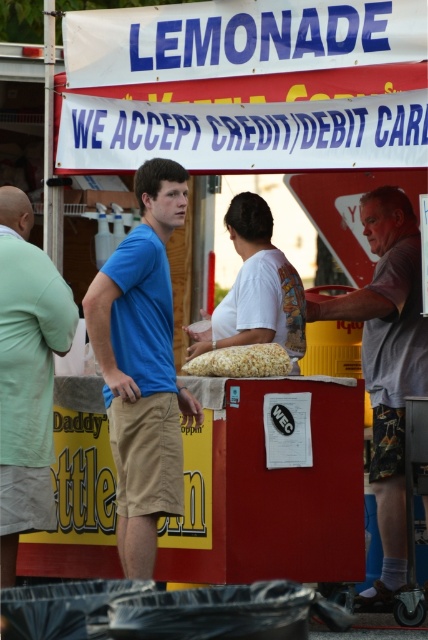
You are standing at the food stand and want to place an order. There are two points marked on the counter where you can place your order. The first point is at coordinate point[50,442] and the second is at coordinate point[258,356]. According to the scene description, which point is closer to you?

Point[50,442] is behind point[258,356], so the point closer to you is point[258,356].

You are a customer at the food stand and want to grab both the light green cotton shirt at left and the golden popcorn at center. Can you reach both items without moving your position?

The light green cotton shirt at left is 1.20 meters away from golden popcorn at center. Since the distance between them is 1.20 meters, you would need to move your position to reach both items unless you have an arm span that can cover that distance.

In the scene shown: You are a customer at the food stand and see a person wearing a blue cotton shirt at left and gray fabric shorts at right. Which piece of clothing is on the left side?

The blue cotton shirt at left is positioned on the left side of gray fabric shorts at right, so the blue cotton shirt at left is on the left side.